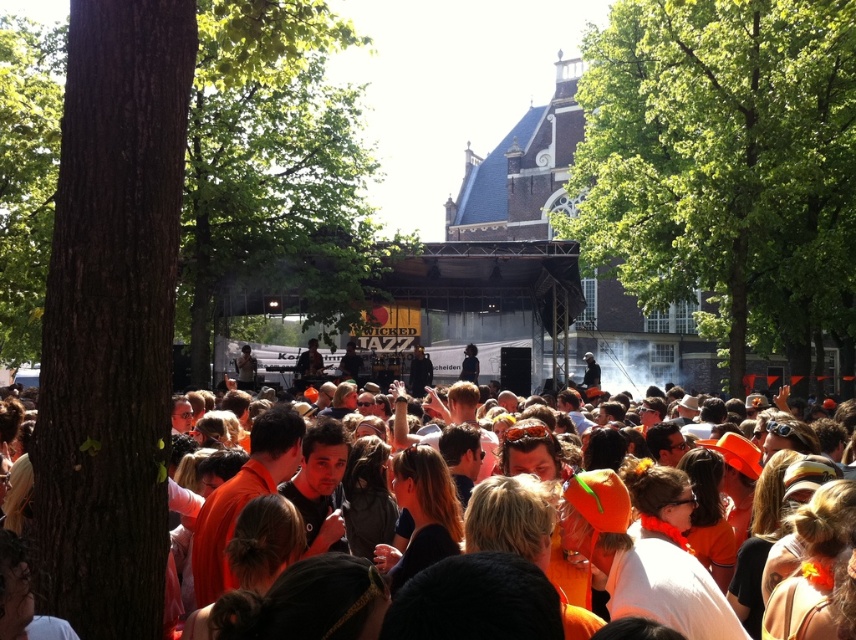
Question: Which of the following is the closest to the observer?

Choices:
 (A) (6, 314)
 (B) (786, 385)
 (C) (791, 209)

Answer: (C)

Question: Is green leafy tree at upper center positioned behind orange clothed crowd at center?

Choices:
 (A) no
 (B) yes

Answer: (B)

Question: Which point is farther from the camera taking this photo?

Choices:
 (A) (3, 234)
 (B) (728, 568)
 (C) (712, 244)

Answer: (A)

Question: Does green leafy tree at center have a larger size compared to green leafy tree at left?

Choices:
 (A) yes
 (B) no

Answer: (A)

Question: Estimate the real-world distances between objects in this image. Which object is closer to the orange clothed crowd at center?

Choices:
 (A) green leafy tree at left
 (B) brown rough bark tree at left
 (C) green leafy tree at center
 (D) green leafy tree at upper center

Answer: (D)

Question: Does green leafy tree at upper center have a lesser width compared to orange clothed crowd at center?

Choices:
 (A) no
 (B) yes

Answer: (B)